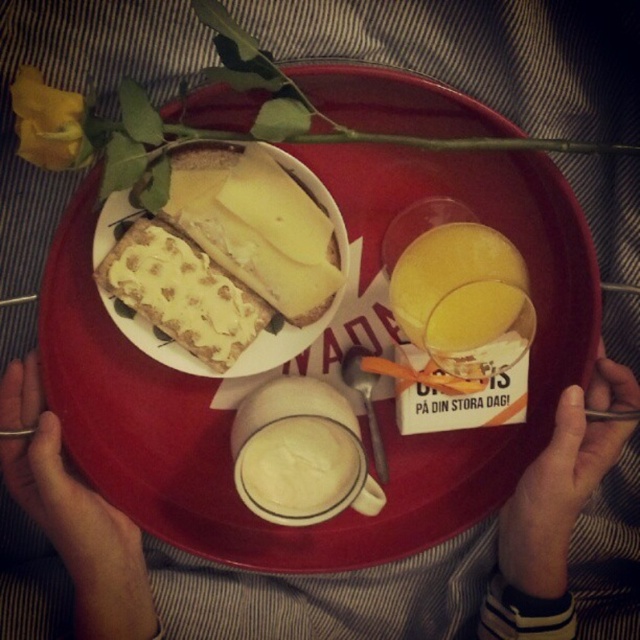
Between white crumbly cheese at upper left and yellow matte juice at center, which one appears on the left side from the viewer's perspective?

white crumbly cheese at upper left

Looking at this image, who is more distant from viewer, [220,289] or [452,284]?

The point [220,289] is more distant.

Between point (189, 273) and point (417, 346), which one is positioned behind?

The point (417, 346) is more distant.

Image resolution: width=640 pixels, height=640 pixels. In order to click on white crumbly cheese at upper left in this screenshot , I will do `click(180, 292)`.

Is point (316, 221) closer to camera compared to point (417, 308)?

Yes, it is.

Between point (216, 198) and point (396, 268), which one is positioned in front?

Point (216, 198)

Does point (268, 209) lie behind point (508, 276)?

No, (268, 209) is in front of (508, 276).

This screenshot has height=640, width=640. Identify the location of yellow cheese at center. (257, 227).

Is white ceramic mug at center below white crumbly cheese at upper left?

Correct, white ceramic mug at center is located below white crumbly cheese at upper left.

Which is more to the right, white ceramic mug at center or white crumbly cheese at upper left?

Positioned to the right is white ceramic mug at center.

Describe the element at coordinates (74, 516) in the screenshot. This screenshot has width=640, height=640. I see `white ceramic mug at center` at that location.

At what (x,y) coordinates should I click in order to perform the action: click on white ceramic mug at center. Please return your answer as a coordinate pair (x, y). Looking at the image, I should click on (74, 516).